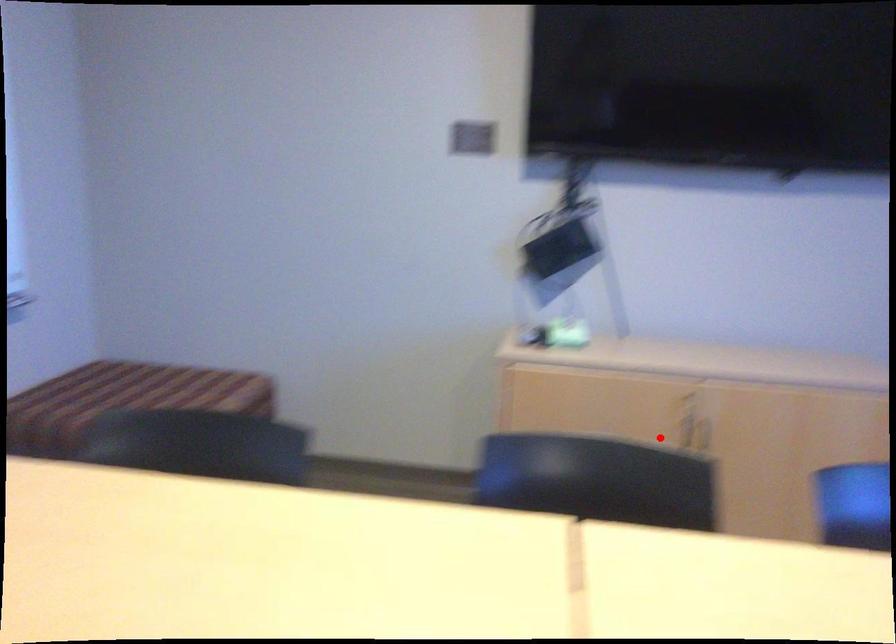
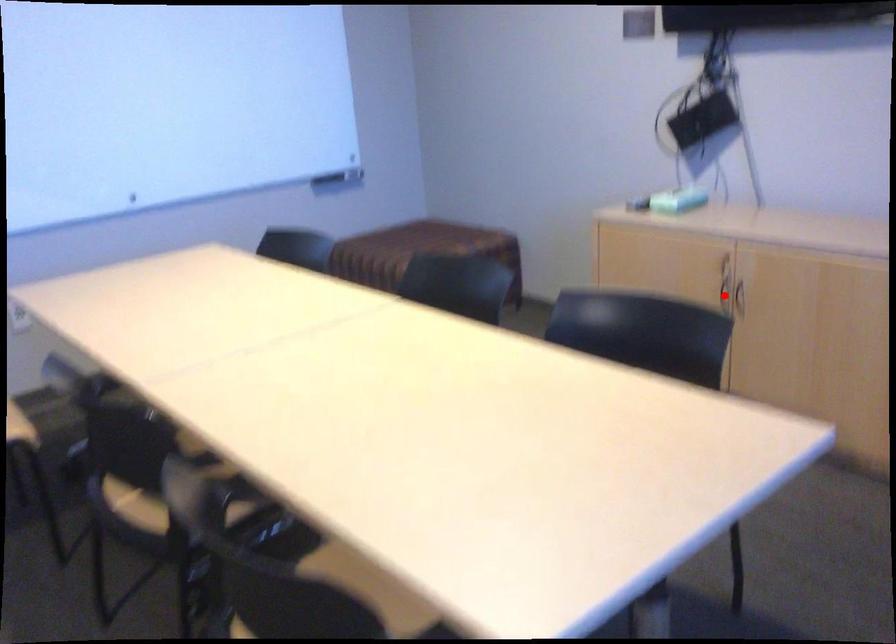
I am providing you with two images of the same scene from different viewpoints. A red point is marked on the first image and another point is marked on the second image. Do the highlighted points in image1 and image2 indicate the same real-world spot?

Yes